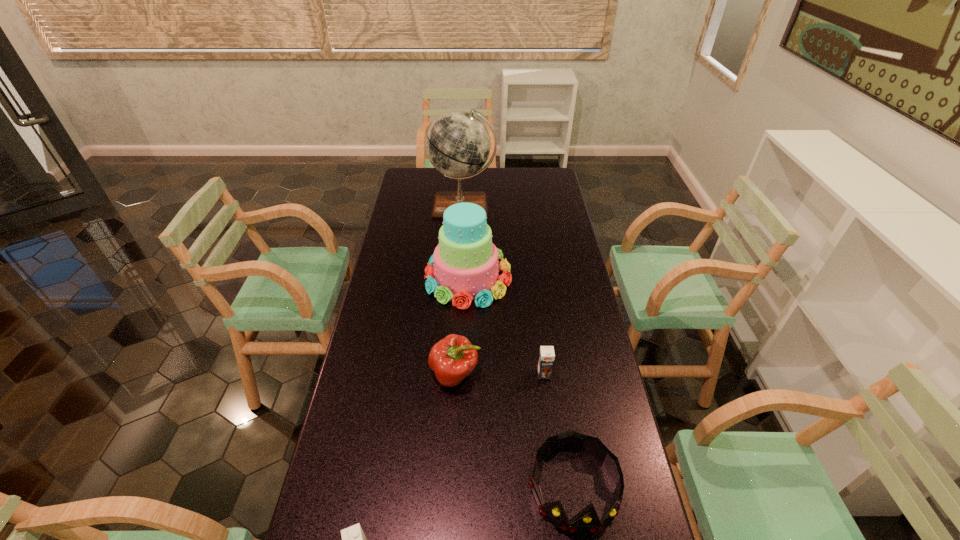
Identify the location of the tallest object. (458, 144).

At what (x,y) coordinates should I click in order to perform the action: click on the farthest object. Please return your answer as a coordinate pair (x, y). This screenshot has height=540, width=960. Looking at the image, I should click on (458, 144).

I want to click on the second farthest object, so click(465, 261).

At what (x,y) coordinates should I click in order to perform the action: click on the second tallest object. Please return your answer as a coordinate pair (x, y). This screenshot has width=960, height=540. Looking at the image, I should click on (465, 261).

Find the location of a particular element. This screenshot has height=540, width=960. tiara is located at coordinates (587, 520).

You are a GUI agent. You are given a task and a screenshot of the screen. Output one action in this format:
    pyautogui.click(x=<x>, y=<y>)
    Task: Click on the pepper
    Image resolution: width=960 pixels, height=540 pixels.
    Given the screenshot: What is the action you would take?
    coord(453,358)

You are a GUI agent. You are given a task and a screenshot of the screen. Output one action in this format:
    pyautogui.click(x=<x>, y=<y>)
    Task: Click on the right chocolate milk
    The width and height of the screenshot is (960, 540).
    Given the screenshot: What is the action you would take?
    [546, 356]

The height and width of the screenshot is (540, 960). Identify the location of free region located 0.290m at the equator of the farthest object. (460, 267).

This screenshot has width=960, height=540. Identify the location of vacant space situated on the front of the fifth shortest object. (464, 410).

This screenshot has height=540, width=960. In order to click on vacant space located 0.240m on the left of the pepper in this screenshot , I will do `click(350, 374)`.